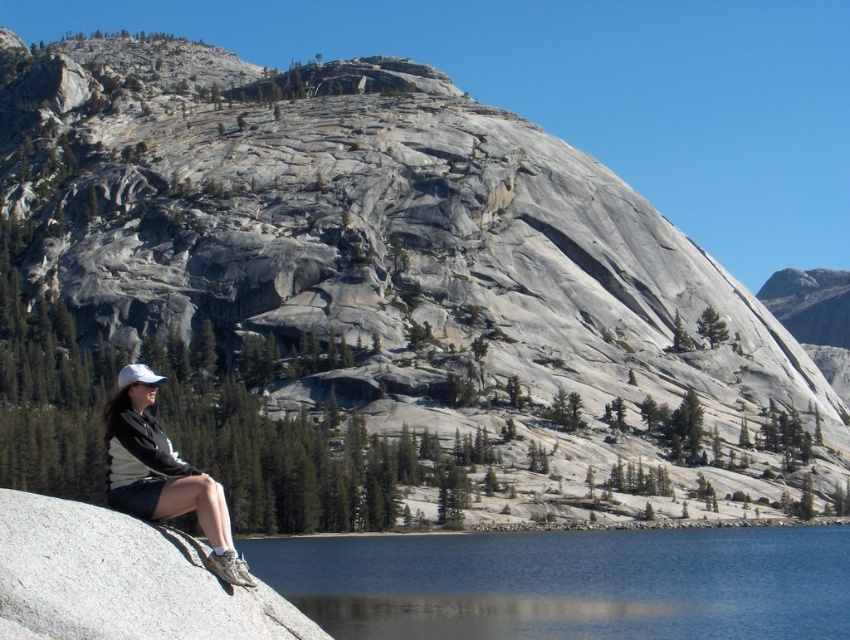
You are a photographer planning to take a wide shot of the gray granite boulder at lower left and the white matte baseball cap at lower left. Which object will appear smaller in the photo?

The gray granite boulder at lower left will appear smaller in the photo because it occupies less space than the white matte baseball cap at lower left.

You are standing at the edge of the lake and want to place a small floating dock exactly where the blue glassy water at lower center is located. According to the coordinates provided, where should you position the dock?

The blue glassy water at lower center is located at coordinates point (x=568, y=582), so you should position the dock there.

You are a photographer planning to capture the gray granite boulder at lower left and the white matte baseball cap at lower left in a single frame. Based on their sizes, which object would appear smaller in the photo?

The gray granite boulder at lower left would appear smaller in the photo because it has a lesser height compared to the white matte baseball cap at lower left.